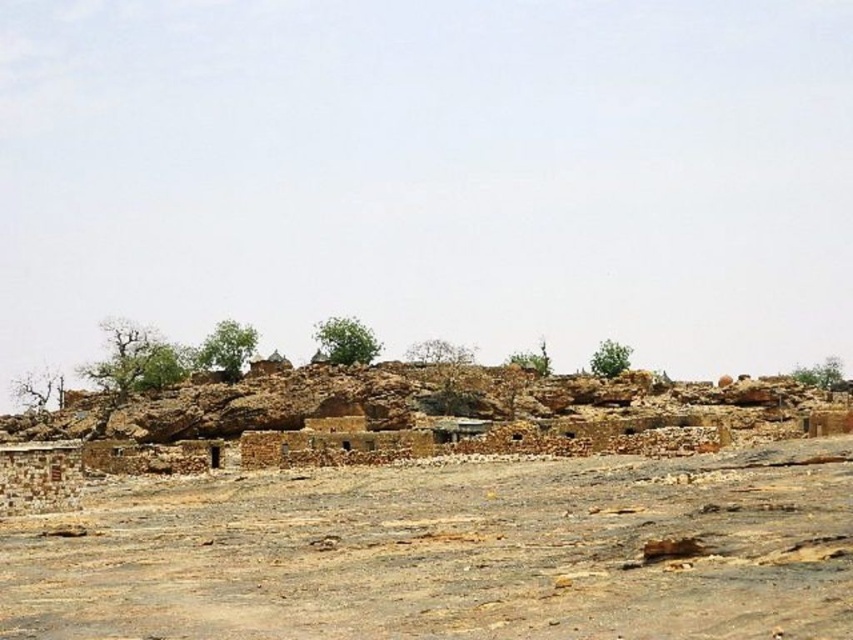
Question: Does brown sandy dirt field at lower center have a lesser width compared to brown mud-brick village at center?

Choices:
 (A) no
 (B) yes

Answer: (B)

Question: Which of the following is the closest to the observer?

Choices:
 (A) brown mud-brick village at center
 (B) brown sandy dirt field at lower center

Answer: (B)

Question: Can you confirm if brown sandy dirt field at lower center is positioned to the right of brown mud-brick village at center?

Choices:
 (A) yes
 (B) no

Answer: (B)

Question: Which of the following is the farthest from the observer?

Choices:
 (A) brown sandy dirt field at lower center
 (B) brown mud-brick village at center

Answer: (B)

Question: Can you confirm if brown sandy dirt field at lower center is positioned below brown mud-brick village at center?

Choices:
 (A) no
 (B) yes

Answer: (A)